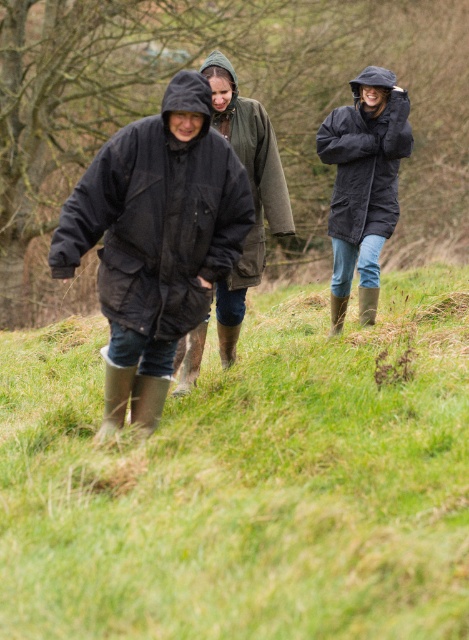
Question: Which of the following is the farthest from the observer?

Choices:
 (A) matte black jacket at center
 (B) black waterproof jacket at upper right
 (C) black matte jacket at left

Answer: (B)

Question: Which point is farther from the camera taking this photo?

Choices:
 (A) (261, 241)
 (B) (127, 164)
 (C) (396, 195)

Answer: (C)

Question: Which of the following is the closest to the observer?

Choices:
 (A) (241, 131)
 (B) (29, 628)

Answer: (B)

Question: Can you confirm if green grass at center is smaller than black waterproof jacket at upper right?

Choices:
 (A) no
 (B) yes

Answer: (B)

Question: Can you confirm if matte black jacket at center is smaller than black waterproof jacket at upper right?

Choices:
 (A) yes
 (B) no

Answer: (B)

Question: Can you confirm if black matte jacket at left is thinner than matte black jacket at center?

Choices:
 (A) yes
 (B) no

Answer: (B)